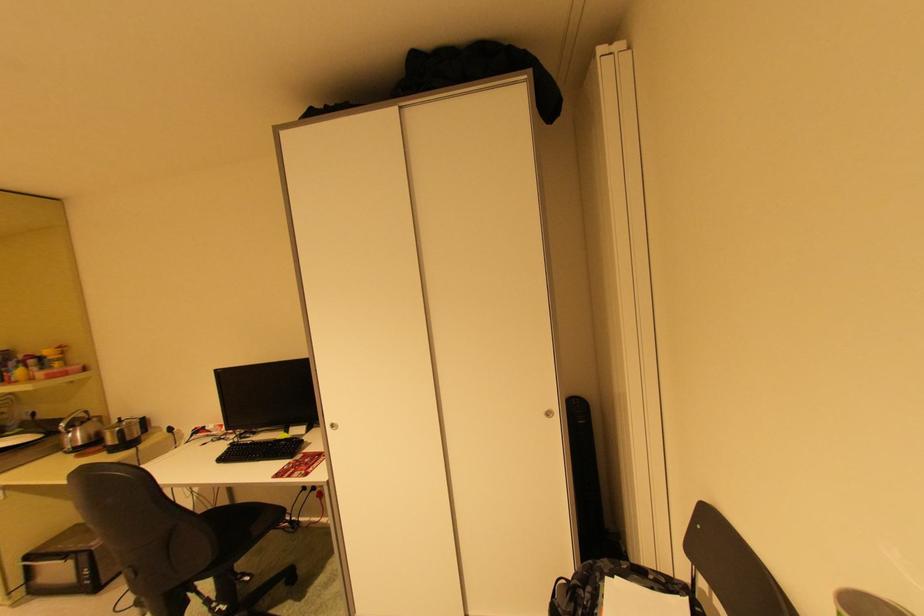
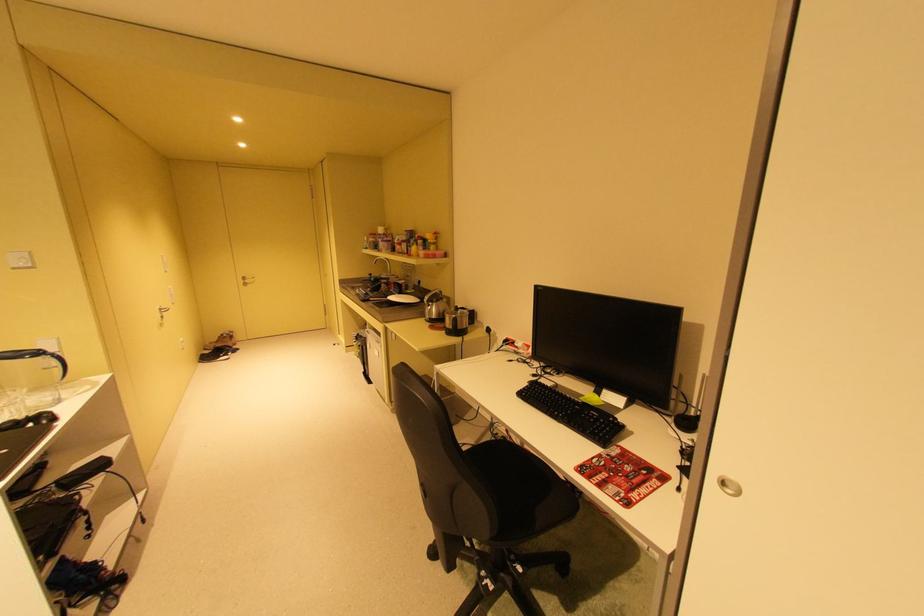
Where in the second image is the point corresponding to (x=79, y=427) from the first image?

(439, 302)